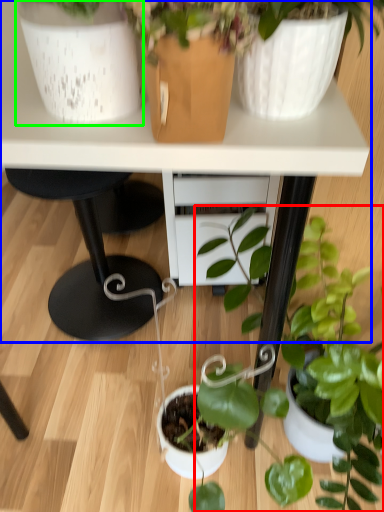
Question: Based on their relative distances, which object is farther from houseplant (highlighted by a red box)? Choose from table (highlighted by a blue box) and flowerpot (highlighted by a green box).

Choices:
 (A) table
 (B) flowerpot

Answer: (B)